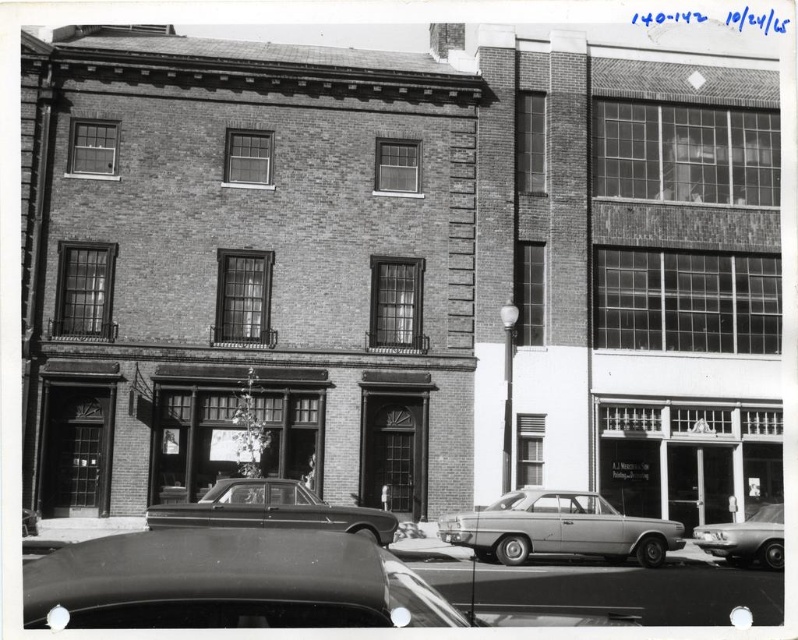
Question: Which point is closer to the camera?

Choices:
 (A) smooth glass storefront at center
 (B) shiny black car at lower center
 (C) shiny metallic sedan at center

Answer: (B)

Question: From the image, what is the correct spatial relationship of smooth glass storefront at center in relation to shiny metallic sedan at center?

Choices:
 (A) above
 (B) below

Answer: (A)

Question: Which of the following is the closest to the observer?

Choices:
 (A) shiny silver sedan at lower right
 (B) silver metallic sedan at center
 (C) brick storefront at center

Answer: (B)

Question: Does brick storefront at center come behind shiny metallic sedan at center?

Choices:
 (A) no
 (B) yes

Answer: (B)

Question: Among these objects, which one is nearest to the camera?

Choices:
 (A) brick storefront at center
 (B) silver metallic sedan at center

Answer: (B)

Question: Is shiny black car at lower center to the right of smooth glass storefront at center from the viewer's perspective?

Choices:
 (A) yes
 (B) no

Answer: (B)